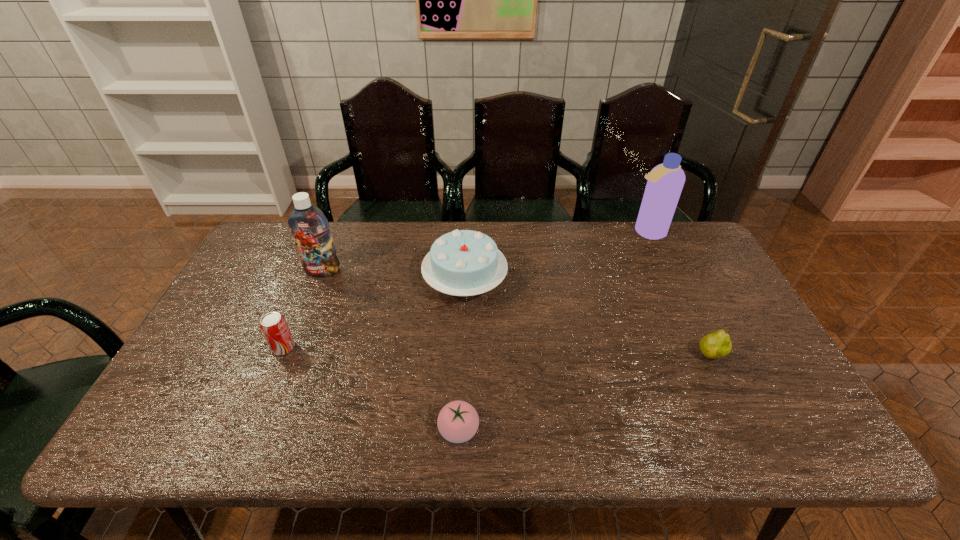
At what (x,y) coordinates should I click in order to perform the action: click on free spot located 0.050m on the front of the second smallest white detergent. Please return your answer as a coordinate pair (x, y). This screenshot has height=540, width=960. Looking at the image, I should click on (234, 301).

Where is `free region located 0.130m on the front surface of the fourth detergent from right to left`? This screenshot has width=960, height=540. free region located 0.130m on the front surface of the fourth detergent from right to left is located at coordinates (493, 380).

The image size is (960, 540). Find the location of `blank space located 0.120m on the front of the pumpkin`. blank space located 0.120m on the front of the pumpkin is located at coordinates (335, 426).

Identify the location of free space located 0.110m on the front of the second nearest detergent. (807, 421).

Find the location of a particular element. Image resolution: width=960 pixels, height=540 pixels. vacant space located on the front-facing side of the third object from right to left is located at coordinates (649, 401).

You are a GUI agent. You are given a task and a screenshot of the screen. Output one action in this format:
    pyautogui.click(x=<x>, y=<y>)
    Task: Click on the object present at the near edge
    Image resolution: width=960 pixels, height=540 pixels.
    Given the screenshot: What is the action you would take?
    pyautogui.click(x=174, y=396)

At what (x,y) coordinates should I click in order to perform the action: click on object that is at the near left corner. Please return your answer as a coordinate pair (x, y). The image size is (960, 540). Looking at the image, I should click on (174, 396).

At what (x,y) coordinates should I click in order to perform the action: click on free spot at the far edge of the desktop. Please return your answer as a coordinate pair (x, y). This screenshot has width=960, height=540. Looking at the image, I should click on (x=566, y=202).

In the image, there is a desktop. Identify the location of free space at the near edge. The height and width of the screenshot is (540, 960). click(217, 422).

In the image, there is a desktop. At what (x,y) coordinates should I click in order to perform the action: click on blank space at the left edge. Please return your answer as a coordinate pair (x, y). Image resolution: width=960 pixels, height=540 pixels. Looking at the image, I should click on (207, 384).